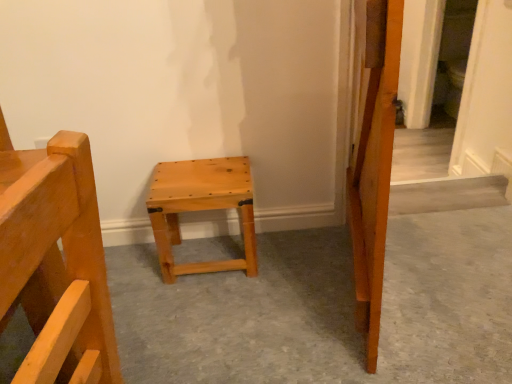
Find the location of `free space in front of natural wood stool at center`. free space in front of natural wood stool at center is located at coordinates (208, 309).